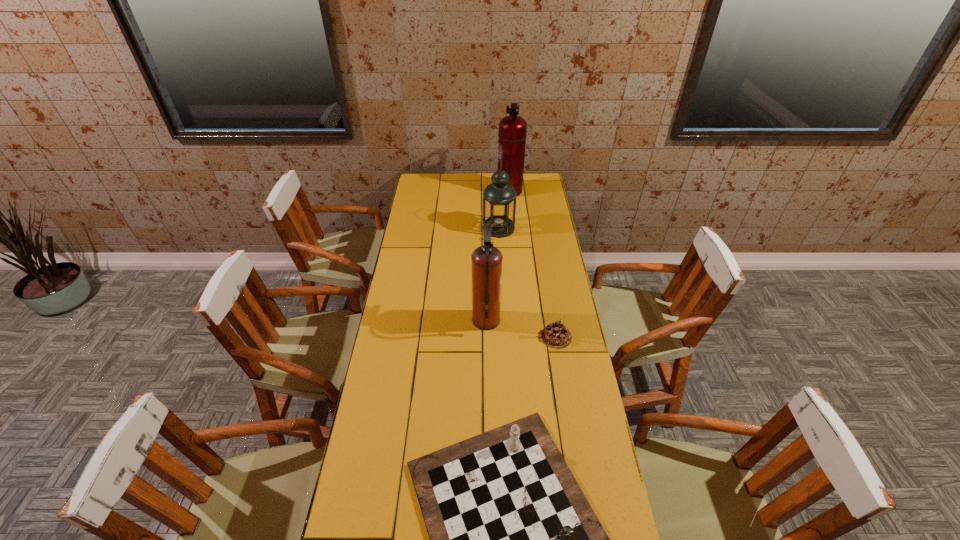
Locate an element on the screen. This screenshot has height=540, width=960. vacant region at the right edge is located at coordinates (546, 282).

Find the location of a particular element. This screenshot has height=540, width=960. vacant space at the far right corner of the desktop is located at coordinates (546, 193).

I want to click on free point between the chocolate cake and the left fire extinguisher, so click(521, 329).

This screenshot has height=540, width=960. Find the location of `free spot between the left fire extinguisher and the chocolate cake`. free spot between the left fire extinguisher and the chocolate cake is located at coordinates click(x=521, y=329).

What are the coordinates of `free space between the shorter fire extinguisher and the shortest object` in the screenshot? It's located at (521, 329).

Where is `vacant area that lies between the shortest object and the farthest object`? The height and width of the screenshot is (540, 960). vacant area that lies between the shortest object and the farthest object is located at coordinates (533, 264).

This screenshot has width=960, height=540. In order to click on vacant area between the chocolate cake and the left fire extinguisher in this screenshot , I will do `click(521, 329)`.

Locate an element on the screen. The height and width of the screenshot is (540, 960). the third closest object to the chocolate cake is located at coordinates (499, 198).

This screenshot has width=960, height=540. Find the location of `object that is the third closest to the fourth nearest object`. object that is the third closest to the fourth nearest object is located at coordinates (555, 335).

This screenshot has height=540, width=960. Find the location of `free space that satisfies the following two spatial constraints: 1. on the nozzle side of the shortest object; 2. on the right side of the tallest object`. free space that satisfies the following two spatial constraints: 1. on the nozzle side of the shortest object; 2. on the right side of the tallest object is located at coordinates (523, 337).